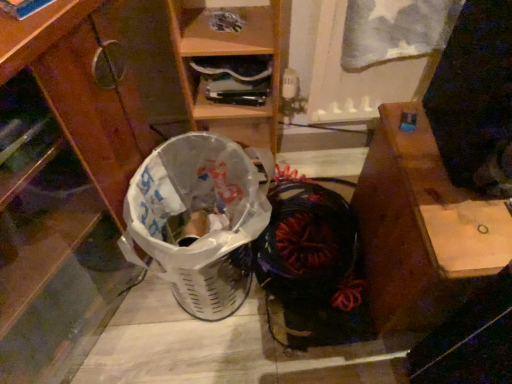
Question: Considering the relative positions of wooden desk at right and white plastic shopping basket at lower left in the image provided, is wooden desk at right to the left or to the right of white plastic shopping basket at lower left?

Choices:
 (A) left
 (B) right

Answer: (B)

Question: From the image's perspective, is wooden desk at right located above or below white plastic shopping basket at lower left?

Choices:
 (A) below
 (B) above

Answer: (B)

Question: Which object is positioned closest to the brushed wood cabinet at lower left?

Choices:
 (A) wooden desk at right
 (B) black fabric shoe at center
 (C) white plastic shopping basket at lower left

Answer: (C)

Question: Based on their relative distances, which object is farther from the wooden desk at right?

Choices:
 (A) brushed wood cabinet at lower left
 (B) white plastic shopping basket at lower left
 (C) black fabric shoe at center

Answer: (A)